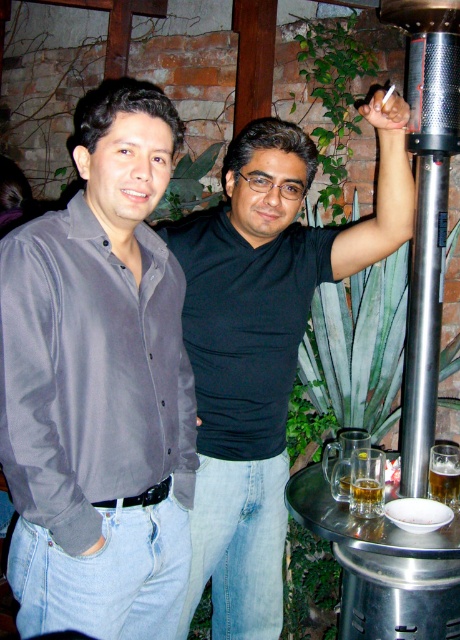
Measure the distance between silver metallic pole at upper right and translucent glass beer at lower center.

A distance of 20.50 inches exists between silver metallic pole at upper right and translucent glass beer at lower center.

Is silver metallic pole at upper right positioned in front of translucent glass beer at lower center?

Yes, silver metallic pole at upper right is in front of translucent glass beer at lower center.

Describe the element at coordinates (425, 212) in the screenshot. I see `silver metallic pole at upper right` at that location.

Identify the location of silver metallic pole at upper right. This screenshot has width=460, height=640. (425, 212).

Between point (265, 337) and point (415, 268), which one is positioned in front?

Point (265, 337)

Can you confirm if black matte shirt at center is taller than silver metallic pole at upper right?

Yes.

Does point (230, 632) lie behind point (413, 148)?

That is True.

Image resolution: width=460 pixels, height=640 pixels. In order to click on black matte shirt at center in this screenshot , I will do `click(264, 346)`.

Can you confirm if black matte shirt at center is positioned below translucent glass beer at lower center?

Actually, black matte shirt at center is above translucent glass beer at lower center.

Who is lower down, black matte shirt at center or translucent glass beer at lower center?

translucent glass beer at lower center is below.

Identify the location of black matte shirt at center. Image resolution: width=460 pixels, height=640 pixels. (264, 346).